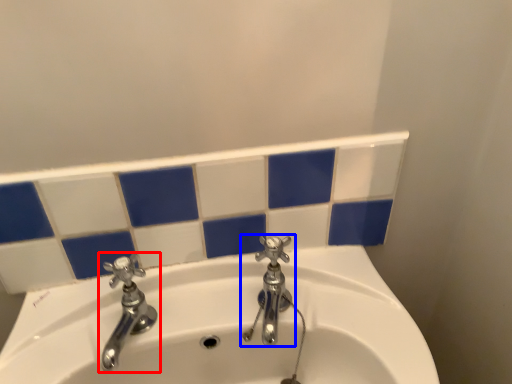
Question: Which of the following is the farthest to the observer, tap (highlighted by a red box) or tap (highlighted by a blue box)?

Choices:
 (A) tap
 (B) tap

Answer: (B)